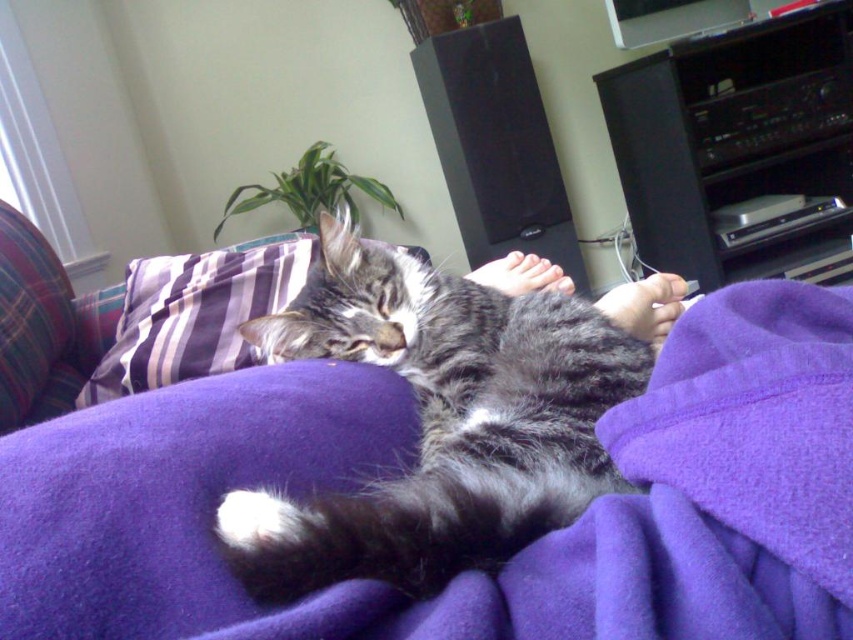
Does gray tabby cat at center appear over purple striped pillow at upper left?

Actually, gray tabby cat at center is below purple striped pillow at upper left.

Which is in front, point (532, 301) or point (173, 326)?

Point (532, 301)

You are a GUI agent. You are given a task and a screenshot of the screen. Output one action in this format:
    pyautogui.click(x=<x>, y=<y>)
    Task: Click on the gray tabby cat at center
    
    Given the screenshot: What is the action you would take?
    439,420

Is purple fleece blanket at center below purple striped pillow at upper left?

Correct, purple fleece blanket at center is located below purple striped pillow at upper left.

Which is above, purple fleece blanket at center or purple striped pillow at upper left?

Positioned higher is purple striped pillow at upper left.

Describe the element at coordinates (407, 460) in the screenshot. Image resolution: width=853 pixels, height=640 pixels. I see `purple fleece blanket at center` at that location.

Find the location of `purple fleece blanket at center`. purple fleece blanket at center is located at coordinates (407, 460).

Describe the element at coordinates (407, 460) in the screenshot. I see `purple fleece blanket at center` at that location.

Is purple fleece blanket at center smaller than gray tabby cat at center?

Yes.

Is point (735, 371) in front of point (518, 522)?

No.

You are a GUI agent. You are given a task and a screenshot of the screen. Output one action in this format:
    pyautogui.click(x=<x>, y=<y>)
    Task: Click on the purple fleece blanket at center
    
    Given the screenshot: What is the action you would take?
    pyautogui.click(x=407, y=460)